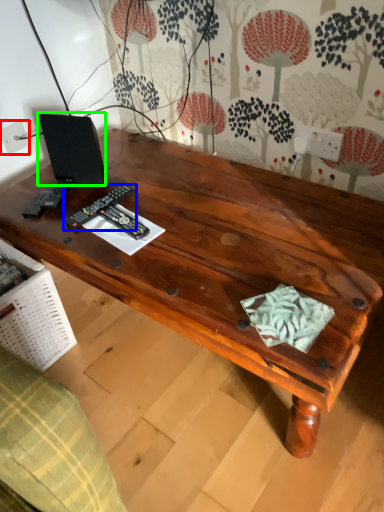
Question: Based on their relative distances, which object is farther from electric outlet (highlighted by a red box)? Choose from control (highlighted by a blue box) and speaker (highlighted by a green box).

Choices:
 (A) control
 (B) speaker

Answer: (A)